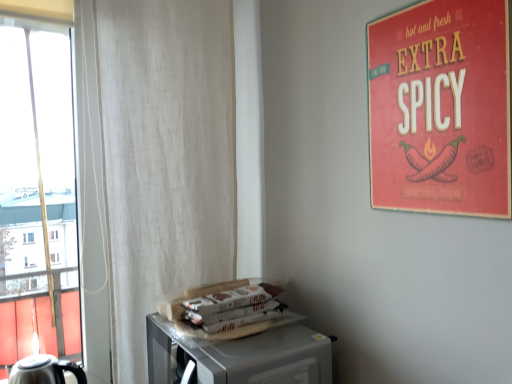
Question: Considering the relative sizes of red matte poster at upper right and white fabric curtain at left in the image provided, is red matte poster at upper right wider than white fabric curtain at left?

Choices:
 (A) no
 (B) yes

Answer: (A)

Question: Can you confirm if red matte poster at upper right is bigger than white fabric curtain at left?

Choices:
 (A) yes
 (B) no

Answer: (B)

Question: From the image's perspective, does red matte poster at upper right appear higher than white fabric curtain at left?

Choices:
 (A) yes
 (B) no

Answer: (A)

Question: Is red matte poster at upper right shorter than white fabric curtain at left?

Choices:
 (A) yes
 (B) no

Answer: (A)

Question: From a real-world perspective, is red matte poster at upper right on top of white fabric curtain at left?

Choices:
 (A) no
 (B) yes

Answer: (B)

Question: Can you confirm if red matte poster at upper right is smaller than white fabric curtain at left?

Choices:
 (A) yes
 (B) no

Answer: (A)

Question: Is metallic microwave at lower right directly adjacent to red matte poster at upper right?

Choices:
 (A) yes
 (B) no

Answer: (B)

Question: Can you confirm if metallic microwave at lower right is positioned to the left of red matte poster at upper right?

Choices:
 (A) no
 (B) yes

Answer: (B)

Question: Does metallic microwave at lower right turn towards red matte poster at upper right?

Choices:
 (A) yes
 (B) no

Answer: (B)

Question: From the image's perspective, is metallic microwave at lower right located above red matte poster at upper right?

Choices:
 (A) no
 (B) yes

Answer: (A)

Question: Is metallic microwave at lower right shorter than red matte poster at upper right?

Choices:
 (A) yes
 (B) no

Answer: (A)

Question: Is metallic microwave at lower right positioned before red matte poster at upper right?

Choices:
 (A) yes
 (B) no

Answer: (B)

Question: Does red matte poster at upper right have a greater width compared to metallic microwave at lower right?

Choices:
 (A) no
 (B) yes

Answer: (A)